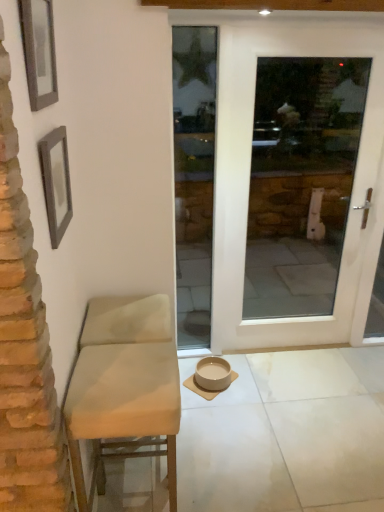
Where is `blank space situated above beige fabric chair at left (from a real-world perspective)`? This screenshot has height=512, width=384. blank space situated above beige fabric chair at left (from a real-world perspective) is located at coordinates (127, 370).